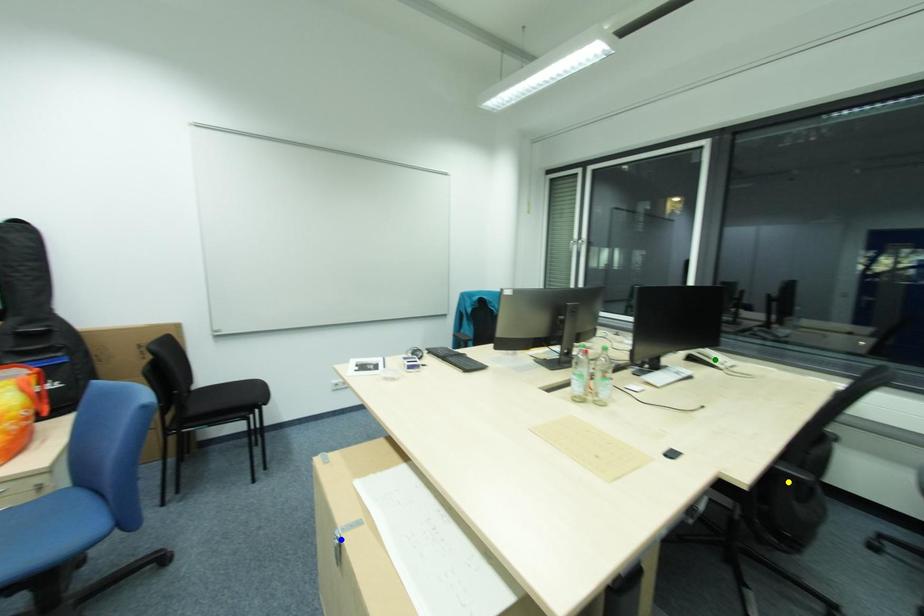
Order these from nearest to farthest:
blue point, green point, yellow point

blue point → yellow point → green point